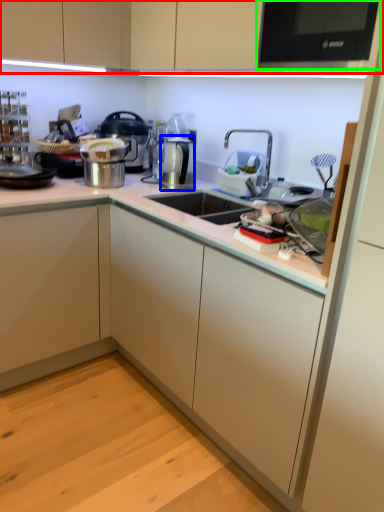
Question: Estimate the real-world distances between objects in this image. Which object is farther from cabinetry (highlighted by a red box), appliance (highlighted by a blue box) or home appliance (highlighted by a green box)?

Choices:
 (A) appliance
 (B) home appliance

Answer: (A)